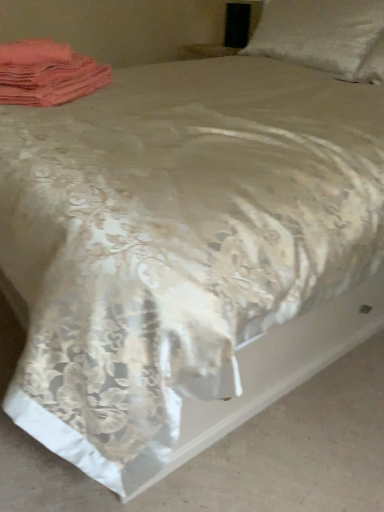
Question: In the image, is pink fabric at upper left on the left side or the right side of silky beige bedspread at center?

Choices:
 (A) right
 (B) left

Answer: (B)

Question: In terms of height, does pink fabric at upper left look taller or shorter compared to silky beige bedspread at center?

Choices:
 (A) short
 (B) tall

Answer: (B)

Question: Which object is positioned farthest from the satin white pillow at upper right?

Choices:
 (A) silky beige bedspread at center
 (B) pink fabric at upper left

Answer: (A)

Question: Which object is the closest to the pink fabric at upper left?

Choices:
 (A) silky beige bedspread at center
 (B) satin white pillow at upper right

Answer: (A)